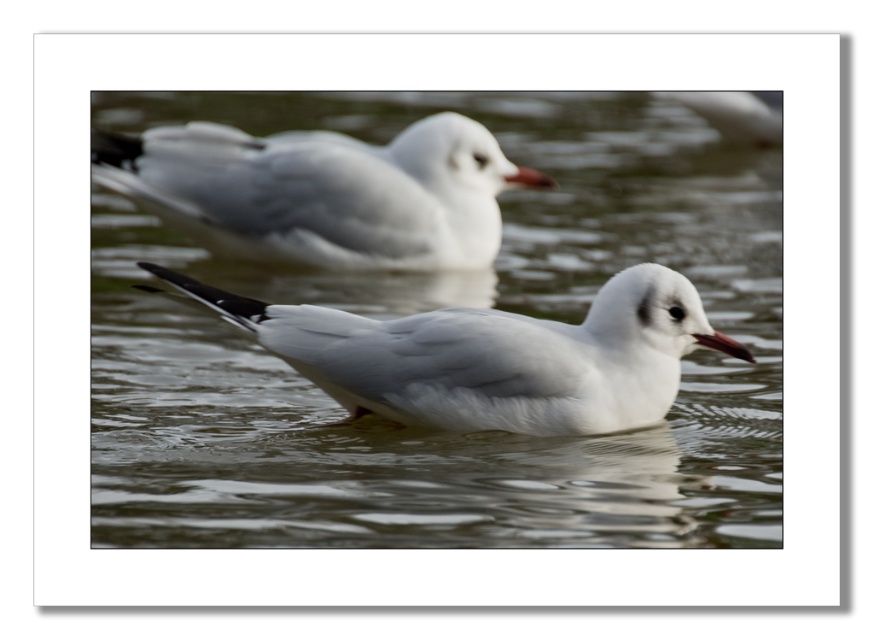
From the picture: You are a wildlife photographer aiming to capture a closeup of the white matte bird at upper center and the matte red beak at center. Your camera can focus on objects within a 30 inch range. Can you focus on both birds simultaneously?

The distance between the white matte bird at upper center and the matte red beak at center is 29.56 inches, which is within the camera focus range of 30 inches. Therefore, you can focus on both birds simultaneously.

You are a photographer trying to capture the white matte bird at upper center and the clear water at center in your shot. Which object should you adjust your camera focus to first if you want to ensure both are in focus?

The clear water at center is to the left of white matte bird at upper center, so you should focus on the white matte bird at upper center first since it is closer to the camera. By focusing on the closer object, the depth of field will naturally include the farther object in acceptable focus.